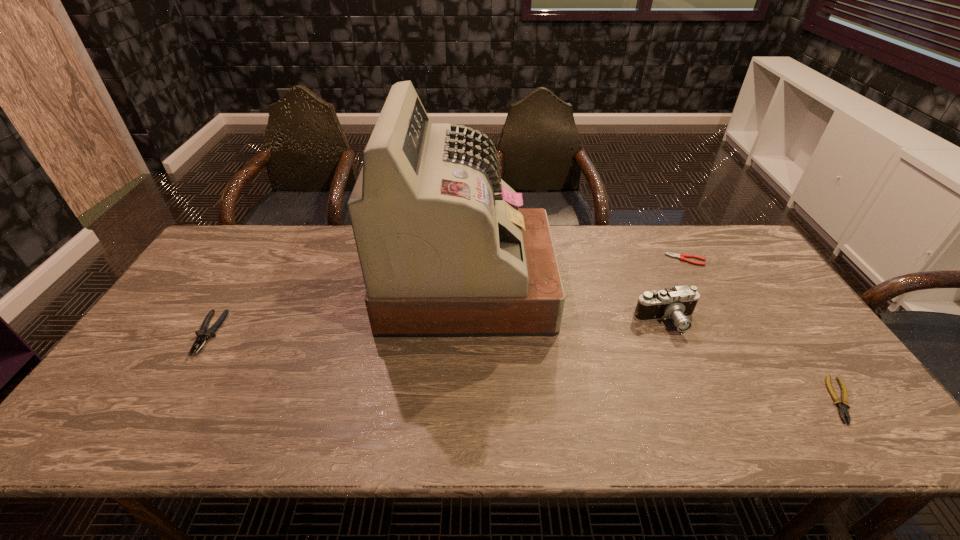
Where is `vacant area in the image that satisfies the following two spatial constraints: 1. on the operating side of the nearest pliers; 2. on the right side of the fourth object from right to left`? This screenshot has height=540, width=960. vacant area in the image that satisfies the following two spatial constraints: 1. on the operating side of the nearest pliers; 2. on the right side of the fourth object from right to left is located at coordinates (464, 400).

Find the location of a particular element. The height and width of the screenshot is (540, 960). vacant space that satisfies the following two spatial constraints: 1. on the operating side of the nearest object; 2. on the right side of the second object from left to right is located at coordinates (464, 400).

I want to click on free region that satisfies the following two spatial constraints: 1. at the gripping part of the second nearest pliers; 2. on the left side of the rightmost pliers, so click(x=168, y=400).

Identify the location of vacant space that satisfies the following two spatial constraints: 1. on the operating side of the cash register; 2. on the right side of the rightmost pliers. This screenshot has width=960, height=540. (464, 400).

In order to click on vacant space that satisfies the following two spatial constraints: 1. on the operating side of the fourth object from right to left; 2. at the gripping part of the second nearest pliers in this screenshot , I will do `click(466, 334)`.